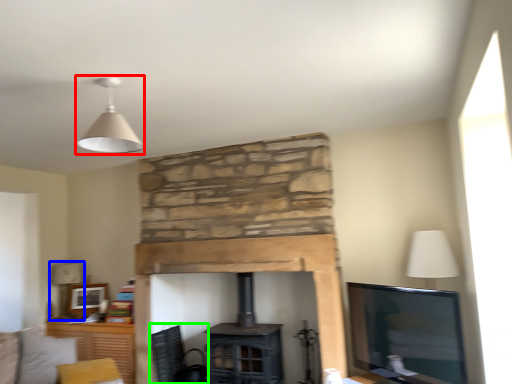
Question: Estimate the real-world distances between objects in this image. Which object is farther from lamp (highlighted by a red box), table lamp (highlighted by a blue box) or swivel chair (highlighted by a green box)?

Choices:
 (A) table lamp
 (B) swivel chair

Answer: (A)